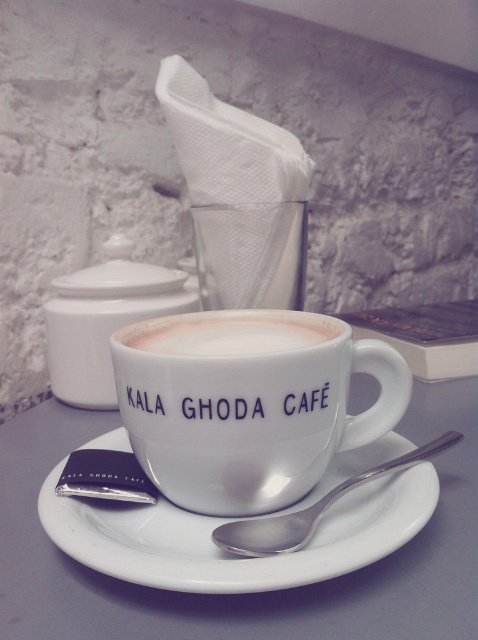
Question: Among these objects, which one is nearest to the camera?

Choices:
 (A) white ceramic cup at center
 (B) foamy white coffee at center
 (C) satin silver spoon at center
 (D) white ceramic saucer at center

Answer: (D)

Question: Observing the image, what is the correct spatial positioning of white ceramic cup at center in reference to white ceramic saucer at center?

Choices:
 (A) below
 (B) above

Answer: (B)

Question: Is white ceramic cup at center closer to camera compared to white ceramic saucer at center?

Choices:
 (A) no
 (B) yes

Answer: (A)

Question: Is white ceramic saucer at center closer to camera compared to foamy white coffee at center?

Choices:
 (A) no
 (B) yes

Answer: (B)

Question: Which point is farther to the camera?

Choices:
 (A) (279, 348)
 (B) (291, 384)

Answer: (A)

Question: Among these objects, which one is farthest from the camera?

Choices:
 (A) foamy white coffee at center
 (B) white ceramic saucer at center
 (C) satin silver spoon at center

Answer: (A)